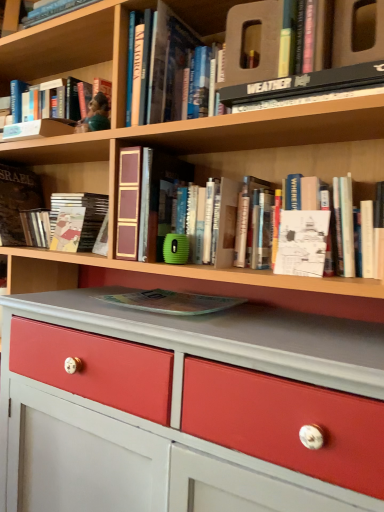
Question: Is brown leather book at left, marked as the 8th book in a right-to-left arrangement, taller or shorter than transparent plastic magazine at center, the fourth book positioned from the right?

Choices:
 (A) short
 (B) tall

Answer: (B)

Question: Would you say brown leather book at left, marked as the 8th book in a right-to-left arrangement, is inside or outside transparent plastic magazine at center, the fourth book positioned from the right?

Choices:
 (A) outside
 (B) inside

Answer: (A)

Question: Which object is the closest to the hardcover book at upper center, acting as the fifth book starting from the right?

Choices:
 (A) matte hardcover book at center, which is counted as the sixth book, starting from the right
 (B) matte green figurine at upper left, the 7th book from the right
 (C) white paper book at upper right, which is the eighth book from left to right
 (D) transparent plastic magazine at center, the fourth book positioned from the right
 (E) black hardcover book at upper center, the 2th book when ordered from right to left

Answer: (B)

Question: Which of these objects is positioned closest to the brown leather book at left, marked as the 8th book in a right-to-left arrangement?

Choices:
 (A) matte green figurine at upper left, acting as the 2th book starting from the left
 (B) hardcover book at upper center, acting as the fifth book starting from the right
 (C) white paper at center
 (D) transparent plastic magazine at center, the fourth book positioned from the right
 (E) matte hardcover book at center, which appears as the 3th book when viewed from the left

Answer: (E)